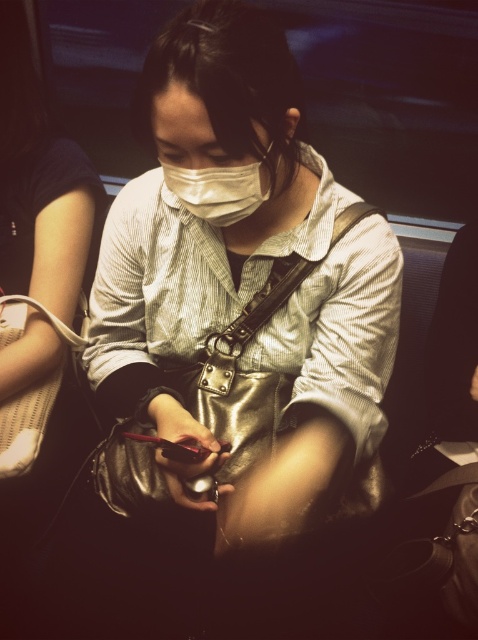
You are sitting in a public transportation vehicle and want to know which of the two points, point (x=249, y=314) or point (x=226, y=180), is closer to you. Can you determine this based on their positions?

Point (x=249, y=314) is further to the viewer than point (x=226, y=180), so the closer point is point (x=226, y=180).